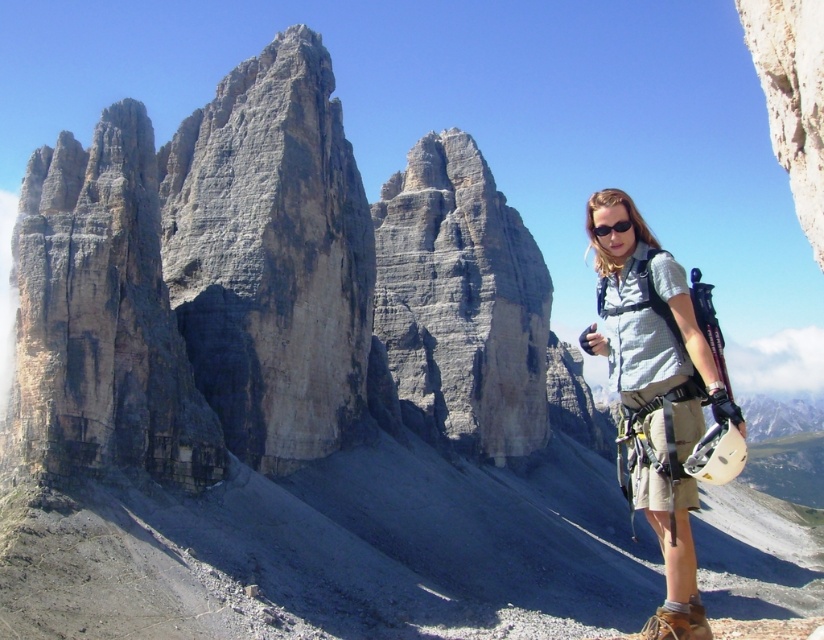
Does light gray mesh shirt at right have a smaller size compared to black matte sunglasses at right?

No, light gray mesh shirt at right is not smaller than black matte sunglasses at right.

Which is below, light gray mesh shirt at right or black matte sunglasses at right?

light gray mesh shirt at right is lower down.

Image resolution: width=824 pixels, height=640 pixels. What do you see at coordinates (654, 394) in the screenshot? I see `light gray mesh shirt at right` at bounding box center [654, 394].

Locate an element on the screen. This screenshot has width=824, height=640. light gray mesh shirt at right is located at coordinates (654, 394).